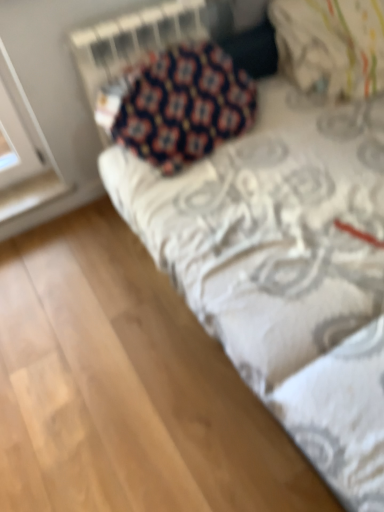
Image resolution: width=384 pixels, height=512 pixels. I want to click on white textured pillow at upper right, so click(x=331, y=44).

What is the approximate width of white textured pillow at upper right?

It is 19.82 inches.

What do you see at coordinates (331, 44) in the screenshot? This screenshot has height=512, width=384. I see `white textured pillow at upper right` at bounding box center [331, 44].

Find the location of `white textured pillow at upper right`. white textured pillow at upper right is located at coordinates (331, 44).